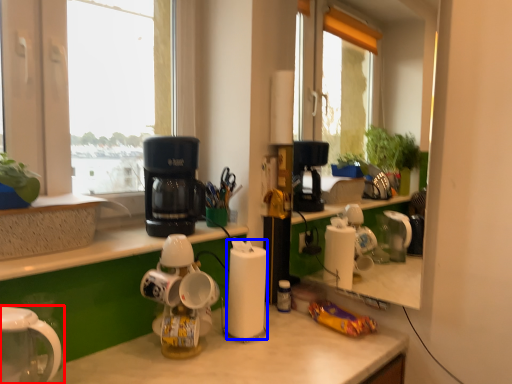
Question: Which point is closer to the camera, home appliance (highlighted by a red box) or paper towel (highlighted by a blue box)?

Choices:
 (A) home appliance
 (B) paper towel

Answer: (A)